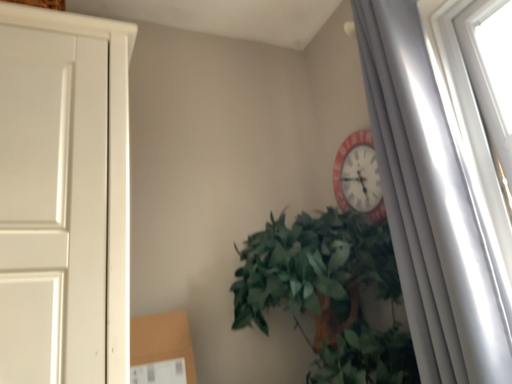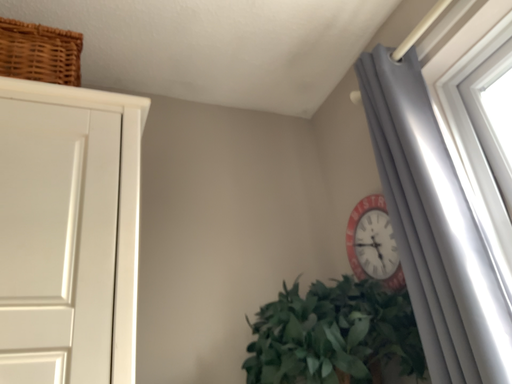
Question: How did the camera likely rotate when shooting the video?

Choices:
 (A) rotated upward
 (B) rotated downward

Answer: (A)